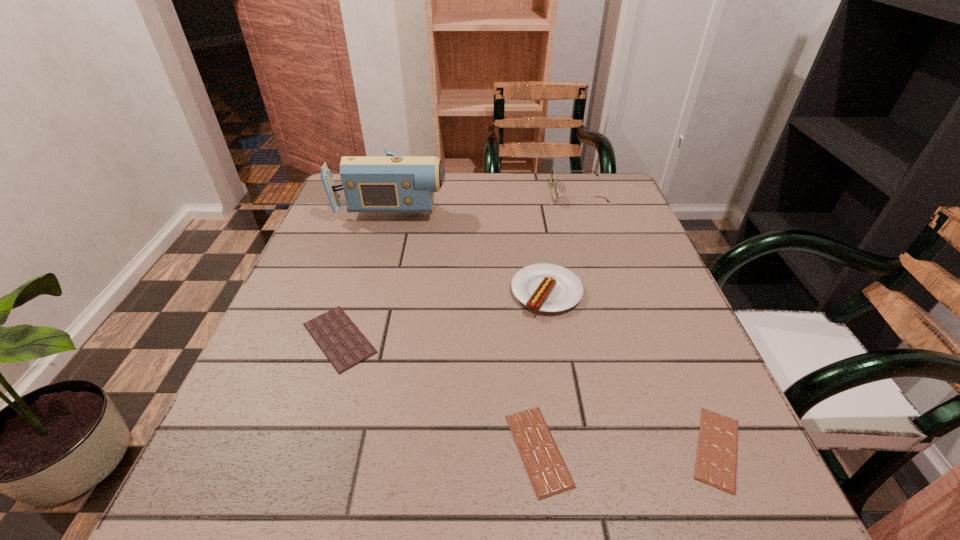
Image resolution: width=960 pixels, height=540 pixels. I want to click on free location located on the front-facing side of the fifth shortest object, so click(427, 193).

This screenshot has width=960, height=540. I want to click on vacant space located 0.160m on the front of the fourth shortest object, so click(x=563, y=388).

Where is `free space located on the back of the farthest chocolate bar`? free space located on the back of the farthest chocolate bar is located at coordinates (377, 217).

Find the location of `free space located on the back of the second chocolate bar from left to right`. free space located on the back of the second chocolate bar from left to right is located at coordinates [x=526, y=338].

This screenshot has height=540, width=960. I want to click on vacant space located 0.110m on the left of the rightmost chocolate bar, so click(x=610, y=449).

This screenshot has height=540, width=960. I want to click on camcorder located in the far edge section of the desktop, so click(393, 183).

Identify the location of sunglasses present at the far edge. The image size is (960, 540). (552, 171).

Where is `camcorder present at the left edge`? The height and width of the screenshot is (540, 960). camcorder present at the left edge is located at coordinates (393, 183).

The width and height of the screenshot is (960, 540). What are the coordinates of `chocolate bar that is positioned at the left edge` in the screenshot? It's located at coord(344,345).

Where is `sunglasses located at the right edge`? The height and width of the screenshot is (540, 960). sunglasses located at the right edge is located at coordinates (552, 171).